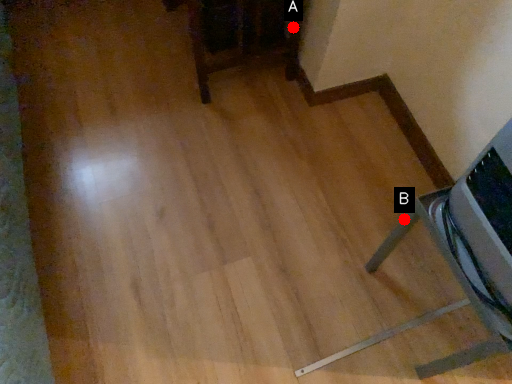
Question: Two points are circled on the image, labeled by A and B beside each circle. Which point is closer to the camera?

Choices:
 (A) A is closer
 (B) B is closer

Answer: (B)